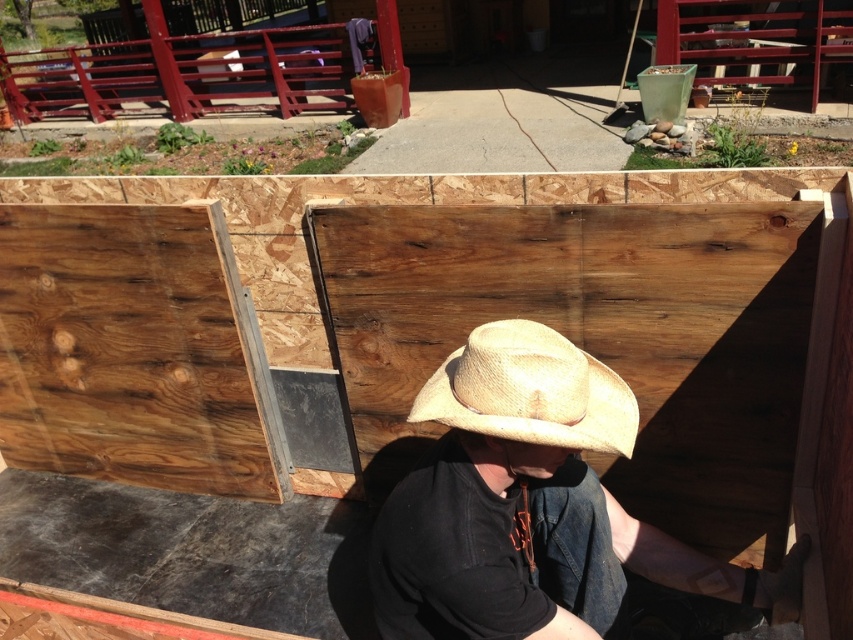
You are a construction worker who needs to place a tool on the ground. You have a tool that is 1.2 meters tall. Can you safely place it between the straw hat at center and the natural wood board at center without it tipping over?

The straw hat at center is not as tall as natural wood board at center. Since the natural wood board at center is taller, placing a 1.2 meter tall tool between them might be unstable. The tool could tip over if it leans against the shorter straw hat at center, so it would be safer to place it against the taller natural wood board at center for better support.

Consider the image. You are a construction worker who needs to place a safety cone at point (532, 506). According to the image, what object is located at that point?

The point (532, 506) has the straw hat at center.